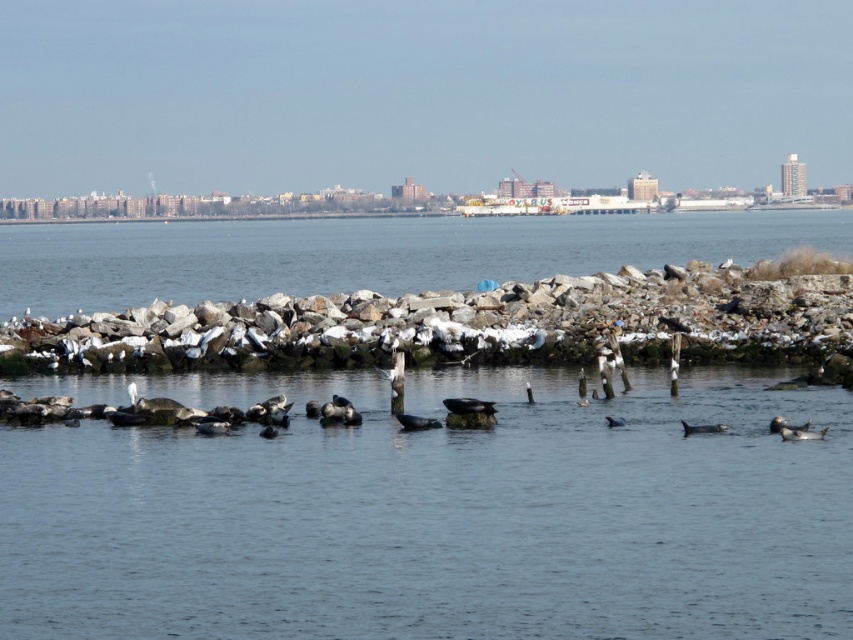
You are a marine biologist observing the coastal scene. You notice a point marked at coordinates (432, 513). Based on the scene description, what does this point most likely represent?

The point at (432, 513) most likely represents the grayish blue water at center as described in the scene.